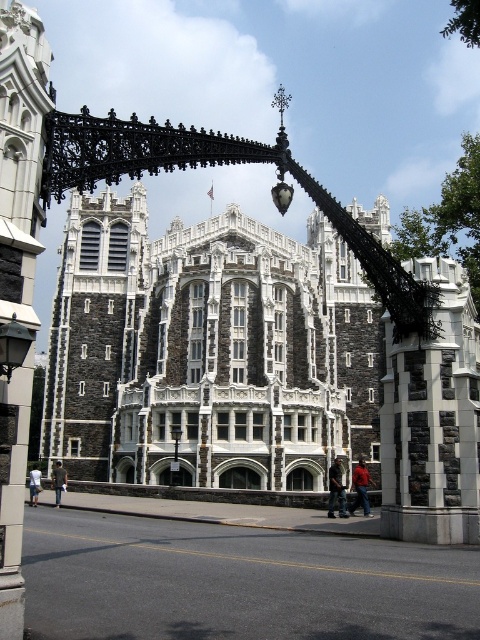
You are standing in front of the grand historic building and see the dark gray stone tower at center and the dark gray jacket at center. Which object is closer to you?

The dark gray jacket at center is closer to you because the dark gray stone tower at center is positioned over it, indicating the jacket is in front.

From the picture: You are a fashion designer observing the image. You need to determine which item of clothing is taller between the dark blue jeans at lower center and the dark gray jacket at center. Which one is taller?

The dark blue jeans at lower center is taller than the dark gray jacket at center according to the description.